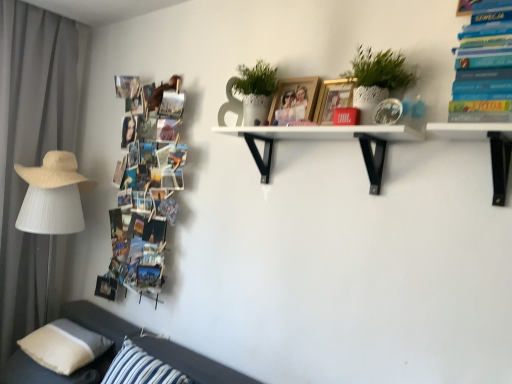
Question: Is gray fabric curtain at left wider than white textured pot at upper center?

Choices:
 (A) no
 (B) yes

Answer: (B)

Question: From the image's perspective, does gray fabric curtain at left appear lower than white textured pot at upper center?

Choices:
 (A) yes
 (B) no

Answer: (A)

Question: From the image's perspective, would you say gray fabric curtain at left is positioned over white textured pot at upper center?

Choices:
 (A) yes
 (B) no

Answer: (B)

Question: Is white textured pot at upper center at the back of gray fabric curtain at left?

Choices:
 (A) yes
 (B) no

Answer: (B)

Question: Does gray fabric curtain at left contain white textured pot at upper center?

Choices:
 (A) no
 (B) yes

Answer: (A)

Question: Is gray fabric curtain at left oriented towards white textured pot at upper center?

Choices:
 (A) no
 (B) yes

Answer: (B)

Question: Are white textured pot at upper center and metallic gold picture frame at upper center, placed as the second picture frame when sorted from back to front, far apart?

Choices:
 (A) yes
 (B) no

Answer: (B)

Question: Is white textured pot at upper center oriented away from metallic gold picture frame at upper center, placed as the second picture frame when sorted from back to front?

Choices:
 (A) no
 (B) yes

Answer: (A)

Question: From the image's perspective, is white textured pot at upper center beneath metallic gold picture frame at upper center, placed as the second picture frame when sorted from back to front?

Choices:
 (A) yes
 (B) no

Answer: (B)

Question: Is white textured pot at upper center in front of metallic gold picture frame at upper center, placed as the second picture frame when sorted from back to front?

Choices:
 (A) yes
 (B) no

Answer: (A)

Question: From the image's perspective, is white textured pot at upper center on top of metallic gold picture frame at upper center, placed as the second picture frame when sorted from back to front?

Choices:
 (A) yes
 (B) no

Answer: (A)

Question: Can you confirm if white textured pot at upper center is positioned to the left of metallic gold picture frame at upper center, the 1th picture frame when ordered from front to back?

Choices:
 (A) yes
 (B) no

Answer: (B)

Question: From the image's perspective, is beige straw hat at left beneath hardcover book at upper right, arranged as the 2th book when viewed from the left?

Choices:
 (A) no
 (B) yes

Answer: (B)